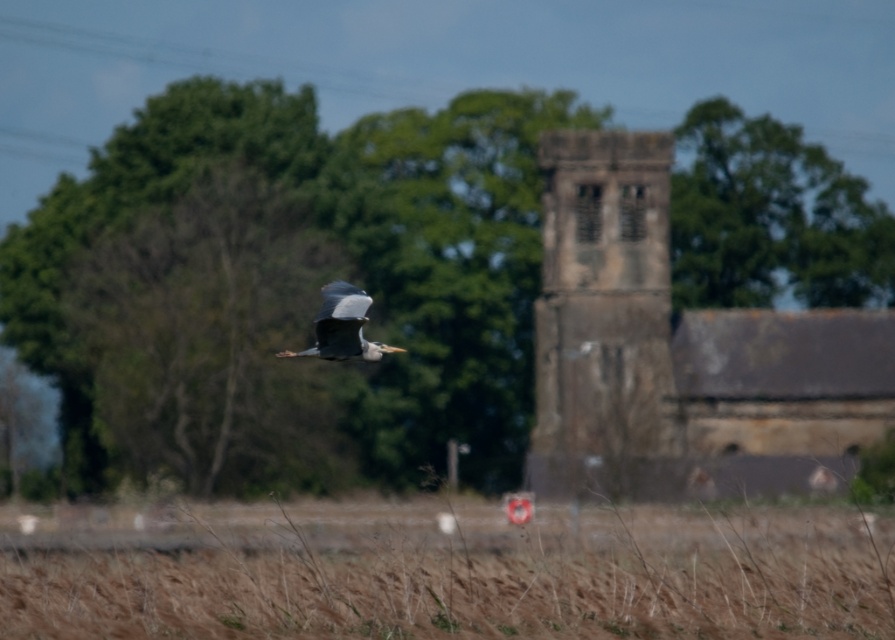
Question: Does green leafy tree at center appear over stone textured church tower at center?

Choices:
 (A) yes
 (B) no

Answer: (A)

Question: Is green leafy tree at center thinner than stone church at center?

Choices:
 (A) yes
 (B) no

Answer: (B)

Question: Is green leafy tree at center further to camera compared to stone church at center?

Choices:
 (A) yes
 (B) no

Answer: (A)

Question: Which object is positioned closest to the stone textured church tower at center?

Choices:
 (A) green leafy tree at upper center
 (B) gray feathered bird at center

Answer: (A)

Question: Which point appears closest to the camera in this image?

Choices:
 (A) (841, 280)
 (B) (64, 184)

Answer: (B)

Question: Which point appears closest to the camera in this image?

Choices:
 (A) (365, 301)
 (B) (408, 300)
 (C) (751, 230)
 (D) (789, 588)

Answer: (A)